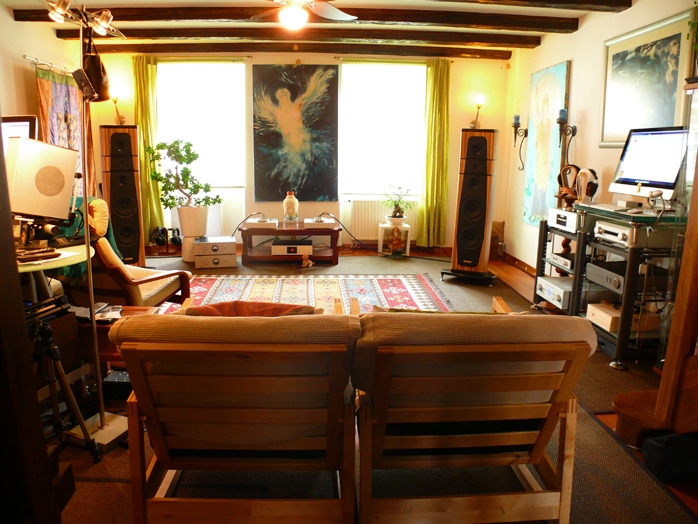
Locate an element on the screen. light is located at coordinates tap(54, 18), tap(96, 30), tap(299, 18), tap(475, 97), tap(118, 86).